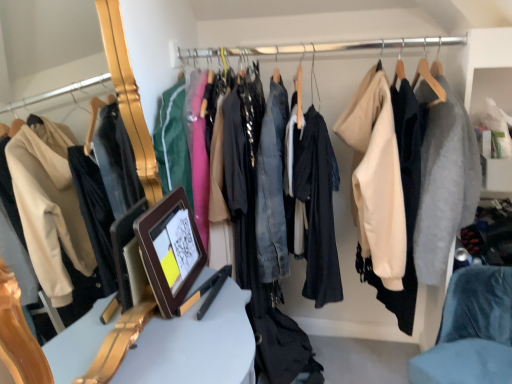
Question: Is white glossy table at center at the right side of velvet blue chair at lower right?

Choices:
 (A) yes
 (B) no

Answer: (B)

Question: Can you confirm if white glossy table at center is wider than velvet blue chair at lower right?

Choices:
 (A) yes
 (B) no

Answer: (B)

Question: Can you confirm if white glossy table at center is positioned to the left of velvet blue chair at lower right?

Choices:
 (A) yes
 (B) no

Answer: (A)

Question: Could you tell me if white glossy table at center is turned towards velvet blue chair at lower right?

Choices:
 (A) no
 (B) yes

Answer: (B)

Question: From a real-world perspective, is white glossy table at center on top of velvet blue chair at lower right?

Choices:
 (A) yes
 (B) no

Answer: (A)

Question: Considering the relative sizes of white glossy table at center and velvet blue chair at lower right in the image provided, is white glossy table at center smaller than velvet blue chair at lower right?

Choices:
 (A) yes
 (B) no

Answer: (B)

Question: Is white glossy table at center at the right side of brown wooden picture frame at center?

Choices:
 (A) no
 (B) yes

Answer: (B)

Question: From the image's perspective, is white glossy table at center above brown wooden picture frame at center?

Choices:
 (A) no
 (B) yes

Answer: (A)

Question: Is white glossy table at center touching brown wooden picture frame at center?

Choices:
 (A) no
 (B) yes

Answer: (A)

Question: Is there a large distance between white glossy table at center and brown wooden picture frame at center?

Choices:
 (A) no
 (B) yes

Answer: (A)

Question: Considering the relative sizes of white glossy table at center and brown wooden picture frame at center in the image provided, is white glossy table at center taller than brown wooden picture frame at center?

Choices:
 (A) yes
 (B) no

Answer: (A)

Question: Is the position of white glossy table at center less distant than that of brown wooden picture frame at center?

Choices:
 (A) no
 (B) yes

Answer: (B)

Question: Is brown wooden picture frame at center at the left side of white glossy table at center?

Choices:
 (A) no
 (B) yes

Answer: (B)